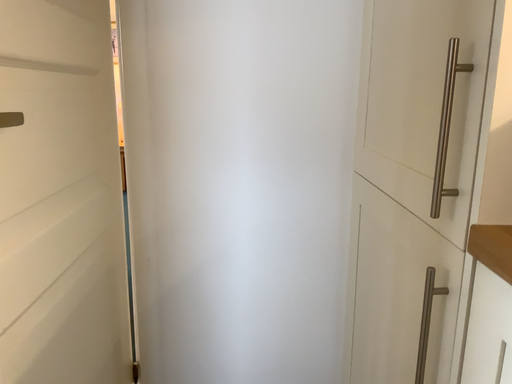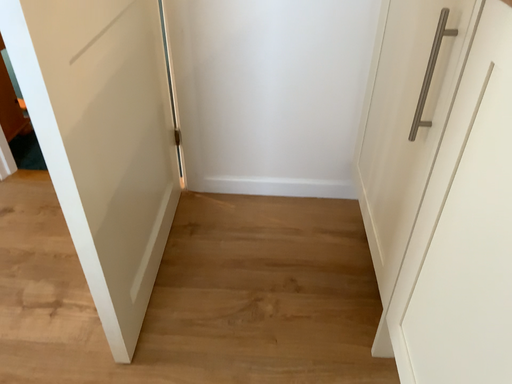
Question: Which way did the camera rotate in the video?

Choices:
 (A) rotated downward
 (B) rotated upward

Answer: (A)